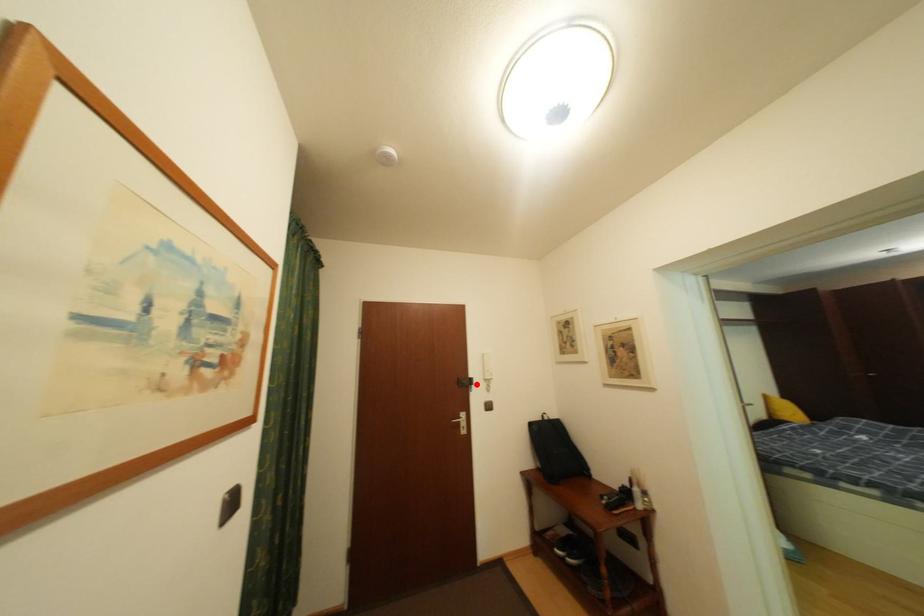
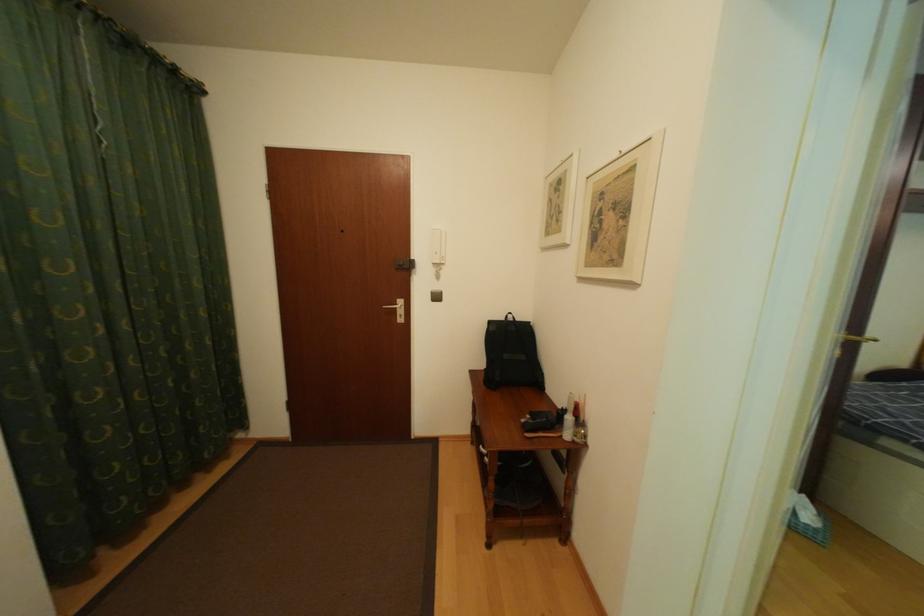
Question: I am providing you with two images of the same scene from different viewpoints. In image1, a red point is highlighted. Considering the same 3D point in image2, which of the following is correct?

Choices:
 (A) It is closer
 (B) It is farther

Answer: (A)